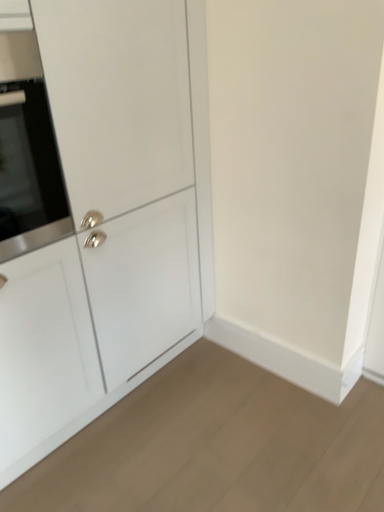
Measure the distance between point (3, 190) and camera.

Point (3, 190) and camera are 1.22 meters apart from each other.

Describe the element at coordinates (29, 173) in the screenshot. I see `satin silver oven at left` at that location.

This screenshot has width=384, height=512. Identify the location of satin silver oven at left. (29, 173).

Image resolution: width=384 pixels, height=512 pixels. Describe the element at coordinates (101, 219) in the screenshot. I see `white matte cabinet at center` at that location.

Where is `white matte cabinet at center`? The image size is (384, 512). white matte cabinet at center is located at coordinates (101, 219).

The image size is (384, 512). What are the coordinates of `satin silver oven at left` in the screenshot? It's located at (29, 173).

Which object is positioned more to the left, white matte cabinet at center or satin silver oven at left?

Positioned to the left is satin silver oven at left.

Which object is closer to the camera, white matte cabinet at center or satin silver oven at left?

white matte cabinet at center is more forward.

Does point (202, 147) come in front of point (26, 127)?

No, it is behind (26, 127).

From the image's perspective, is white matte cabinet at center located above or below satin silver oven at left?

Based on their image positions, white matte cabinet at center is located beneath satin silver oven at left.

From a real-world perspective, is white matte cabinet at center over satin silver oven at left?

No, from a real-world perspective, white matte cabinet at center is not over satin silver oven at left

Can you confirm if white matte cabinet at center is thinner than satin silver oven at left?

No, white matte cabinet at center is not thinner than satin silver oven at left.

Considering the sizes of objects white matte cabinet at center and satin silver oven at left in the image provided, who is shorter, white matte cabinet at center or satin silver oven at left?

satin silver oven at left is shorter.

Who is bigger, white matte cabinet at center or satin silver oven at left?

white matte cabinet at center.

Is satin silver oven at left completely or partially inside white matte cabinet at center?

That's correct, satin silver oven at left is inside white matte cabinet at center.

Are white matte cabinet at center and satin silver oven at left far apart?

white matte cabinet at center is actually quite close to satin silver oven at left.

Does white matte cabinet at center turn towards satin silver oven at left?

Yes, white matte cabinet at center is facing satin silver oven at left.

What's the angular difference between white matte cabinet at center and satin silver oven at left's facing directions?

The facing directions of white matte cabinet at center and satin silver oven at left are 0.000464 degrees apart.

Find the location of a particular element. This screenshot has height=512, width=384. oven behind the white matte cabinet at center is located at coordinates (29, 173).

Considering the relative positions of satin silver oven at left and white matte cabinet at center in the image provided, is satin silver oven at left to the right of white matte cabinet at center from the viewer's perspective?

No.

Is the depth of satin silver oven at left greater than that of white matte cabinet at center?

Yes, satin silver oven at left is behind white matte cabinet at center.

Does point (32, 179) come farther from viewer compared to point (20, 234)?

No, it is in front of (20, 234).

From the image's perspective, which is above, satin silver oven at left or white matte cabinet at center?

satin silver oven at left, from the image's perspective.

From a real-world perspective, is satin silver oven at left beneath white matte cabinet at center?

No, from a real-world perspective, satin silver oven at left is not below white matte cabinet at center.

Can you confirm if satin silver oven at left is wider than white matte cabinet at center?

No, satin silver oven at left is not wider than white matte cabinet at center.

Can you confirm if satin silver oven at left is taller than white matte cabinet at center?

No, satin silver oven at left is not taller than white matte cabinet at center.

Who is smaller, satin silver oven at left or white matte cabinet at center?

satin silver oven at left.

Does satin silver oven at left contain white matte cabinet at center?

Definitely not — white matte cabinet at center is not inside satin silver oven at left.

Are satin silver oven at left and white matte cabinet at center beside each other?

They are not placed beside each other.

Is white matte cabinet at center at the back of satin silver oven at left?

Yes.

What's the angular difference between satin silver oven at left and white matte cabinet at center's facing directions?

0.000464 degrees separate the facing orientations of satin silver oven at left and white matte cabinet at center.

Locate an element on the screen. This screenshot has height=512, width=384. cabinetry on the right side of satin silver oven at left is located at coordinates (101, 219).

Locate an element on the screen. The image size is (384, 512). oven above the white matte cabinet at center (from a real-world perspective) is located at coordinates (29, 173).

Find the location of a particular element. oven located above the white matte cabinet at center (from the image's perspective) is located at coordinates (29, 173).